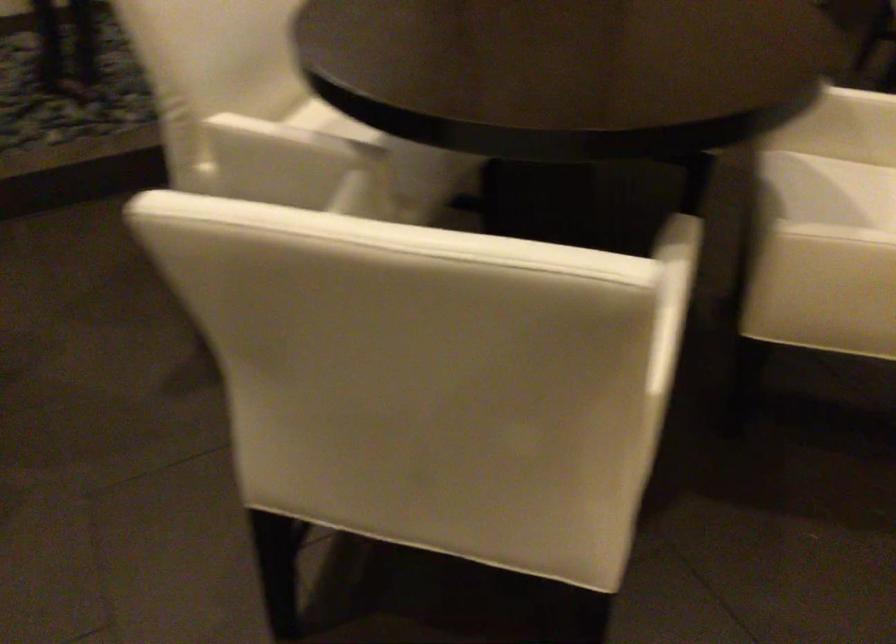
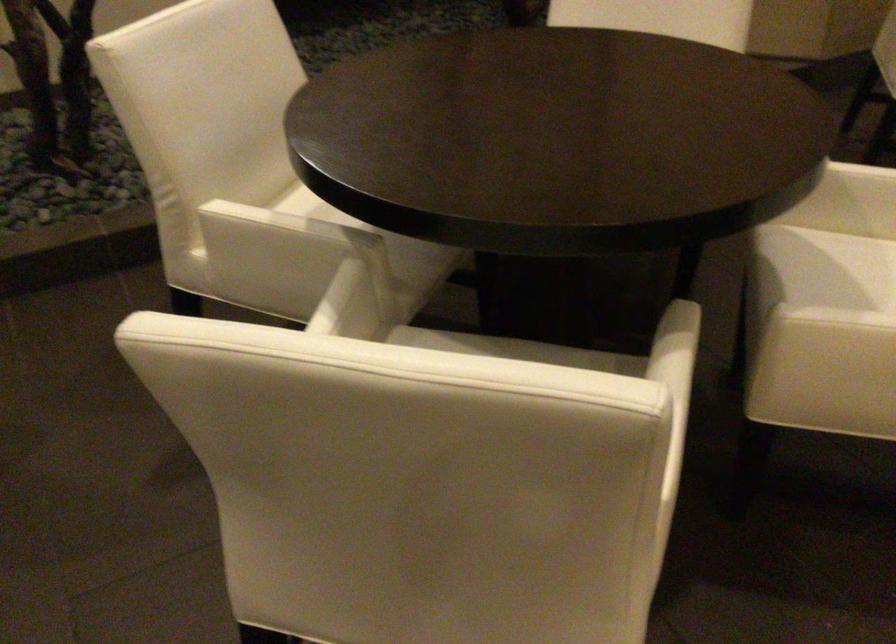
Find the pixel in the second image that matches the point at 686,261 in the first image.

(688, 353)